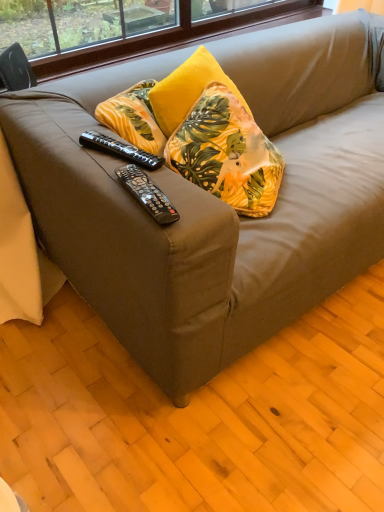
The height and width of the screenshot is (512, 384). I want to click on free space between black plastic remote control at center, which is the 2th remote control from top to bottom, and black plastic remote control at center, the 1th remote control positioned from the back, so click(x=127, y=164).